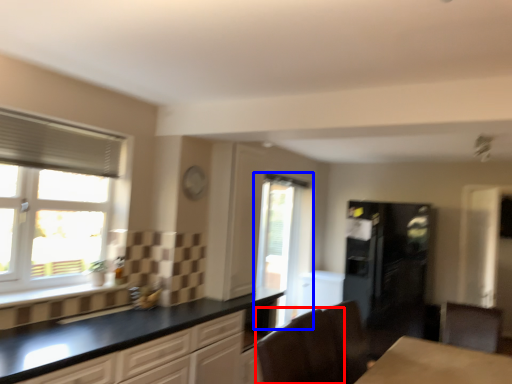
Question: Which of the following is the farthest to the observer, armchair (highlighted by a red box) or window (highlighted by a blue box)?

Choices:
 (A) armchair
 (B) window

Answer: (B)